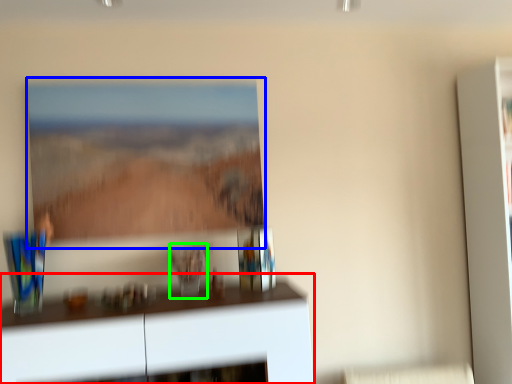
Question: Considering the real-world distances, which object is closest to furniture (highlighted by a red box)? picture frame (highlighted by a blue box) or glass vase (highlighted by a green box).

Choices:
 (A) picture frame
 (B) glass vase

Answer: (B)